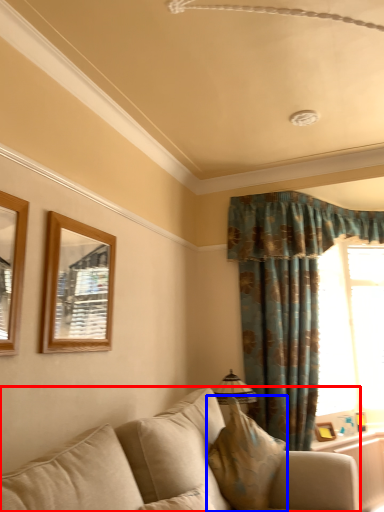
Question: Which object appears closest to the camera in this image, studio couch (highlighted by a red box) or pillow (highlighted by a blue box)?

Choices:
 (A) studio couch
 (B) pillow

Answer: (A)